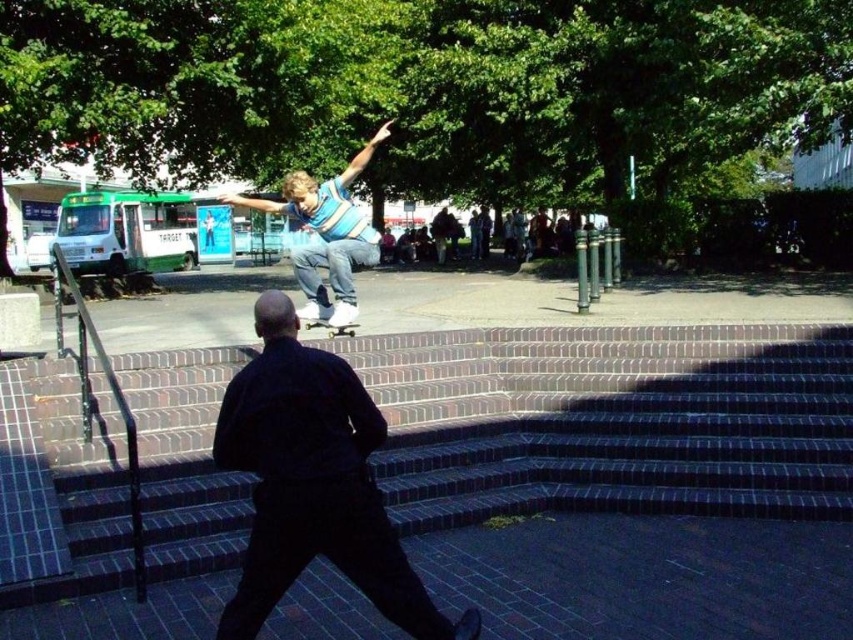
Question: Among these objects, which one is nearest to the camera?

Choices:
 (A) denim jeans at center
 (B) dark blue shirt at center
 (C) dark brick stairs at center
 (D) wooden deck at center

Answer: (B)

Question: Among these objects, which one is nearest to the camera?

Choices:
 (A) dark brick stairs at center
 (B) denim jeans at center

Answer: (A)

Question: Among these points, which one is farthest from the camera?

Choices:
 (A) (357, 324)
 (B) (583, 365)
 (C) (347, 276)

Answer: (A)

Question: Is denim jeans at center to the right of wooden deck at center from the viewer's perspective?

Choices:
 (A) no
 (B) yes

Answer: (A)

Question: Is dark brick stairs at center to the right of denim jeans at center from the viewer's perspective?

Choices:
 (A) no
 (B) yes

Answer: (B)

Question: Does dark brick stairs at center appear over denim jeans at center?

Choices:
 (A) yes
 (B) no

Answer: (B)